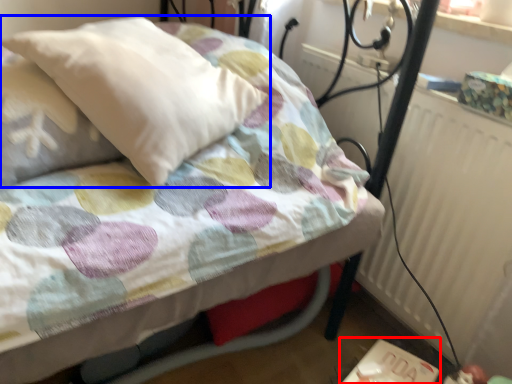
Question: Which point is further to the camera, table (highlighted by a red box) or pillow (highlighted by a blue box)?

Choices:
 (A) table
 (B) pillow

Answer: (A)